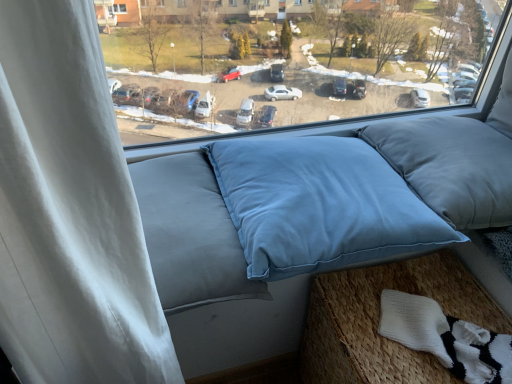
I want to click on blue fabric pillow at center, which appears as the 2th pillow when viewed from the right, so click(319, 205).

This screenshot has height=384, width=512. What do you see at coordinates (378, 321) in the screenshot?
I see `light blue fabric cushion at lower right` at bounding box center [378, 321].

What do you see at coordinates (446, 338) in the screenshot? Image resolution: width=512 pixels, height=384 pixels. I see `white knitted socks at lower right` at bounding box center [446, 338].

What do you see at coordinates (287, 72) in the screenshot?
I see `blue fabric pillows at center` at bounding box center [287, 72].

Identify the location of blue fabric pillow at center, which appears as the 2th pillow when viewed from the right. (319, 205).

Does white knitted socks at lower right have a larger size compared to satin blue pillow at center, the second pillow when ordered from left to right?

No.

Where is `material that appears on the left of satin blue pillow at center, the second pillow when ordered from left to right`? material that appears on the left of satin blue pillow at center, the second pillow when ordered from left to right is located at coordinates (446, 338).

How different are the orientations of white knitted socks at lower right and satin blue pillow at center, the second pillow when ordered from left to right, in degrees?

The facing directions of white knitted socks at lower right and satin blue pillow at center, the second pillow when ordered from left to right, are 29.2 degrees apart.

Looking at this image, is blue fabric pillows at center at the right side of white knitted socks at lower right?

In fact, blue fabric pillows at center is to the left of white knitted socks at lower right.

Consider the image. Is blue fabric pillows at center positioned far away from white knitted socks at lower right?

blue fabric pillows at center is near white knitted socks at lower right, not far away.

From a real-world perspective, which object rests below the other?

From a 3D spatial view, white knitted socks at lower right is below.

From a real-world perspective, starting from the light blue fabric cushion at lower right, which pillow is the 1st one vertically above it? Please provide its 2D coordinates.

[(319, 205)]

Is light blue fabric cushion at lower right turned away from blue fabric pillow at center, the first pillow from the left?

No.

Can you confirm if light blue fabric cushion at lower right is smaller than blue fabric pillow at center, the first pillow from the left?

No.

Looking at this image, does light blue fabric cushion at lower right have a lesser width compared to blue fabric pillow at center, the first pillow from the left?

Indeed, light blue fabric cushion at lower right has a lesser width compared to blue fabric pillow at center, the first pillow from the left.

From a real-world perspective, who is located higher, light blue fabric cushion at lower right or satin blue pillow at center, acting as the 1th pillow starting from the right?

satin blue pillow at center, acting as the 1th pillow starting from the right, is physically above.

Which object is wider, light blue fabric cushion at lower right or satin blue pillow at center, acting as the 1th pillow starting from the right?

Wider between the two is light blue fabric cushion at lower right.

Which is correct: light blue fabric cushion at lower right is inside satin blue pillow at center, the second pillow when ordered from left to right, or outside of it?

light blue fabric cushion at lower right exists outside the volume of satin blue pillow at center, the second pillow when ordered from left to right.

Between light blue fabric cushion at lower right and satin blue pillow at center, acting as the 1th pillow starting from the right, which one has larger size?

With larger size is light blue fabric cushion at lower right.

In terms of width, does blue fabric pillows at center look wider or thinner when compared to blue fabric pillow at center, which appears as the 2th pillow when viewed from the right?

blue fabric pillows at center is thinner than blue fabric pillow at center, which appears as the 2th pillow when viewed from the right.

Is point (429, 86) closer or farther from the camera than point (273, 280)?

Point (429, 86) appears to be farther away from the viewer than point (273, 280).

Is blue fabric pillows at center closer to camera compared to blue fabric pillow at center, which appears as the 2th pillow when viewed from the right?

No, blue fabric pillows at center is further to the viewer.

Where is `bed frame below the satin blue pillow at center, acting as the 1th pillow starting from the right (from a real-world perspective)`? This screenshot has width=512, height=384. bed frame below the satin blue pillow at center, acting as the 1th pillow starting from the right (from a real-world perspective) is located at coordinates (378, 321).

From the image's perspective, who appears lower, satin blue pillow at center, the second pillow when ordered from left to right, or light blue fabric cushion at lower right?

Result: light blue fabric cushion at lower right appears lower in the image.

Based on the photo, how different are the orientations of satin blue pillow at center, the second pillow when ordered from left to right, and light blue fabric cushion at lower right in degrees?

86.3 degrees.

Is satin blue pillow at center, acting as the 1th pillow starting from the right, surrounding light blue fabric cushion at lower right?

No.

Is blue fabric pillow at center, which appears as the 2th pillow when viewed from the right, closer to the viewer compared to white knitted socks at lower right?

Yes, it is in front of white knitted socks at lower right.

What's the angular difference between blue fabric pillow at center, the first pillow from the left, and white knitted socks at lower right's facing directions?

The angle between the facing direction of blue fabric pillow at center, the first pillow from the left, and the facing direction of white knitted socks at lower right is 32.4 degrees.

Is blue fabric pillow at center, the first pillow from the left, oriented towards white knitted socks at lower right?

No.

Where is `the 2nd pillow positioned above the white knitted socks at lower right (from a real-world perspective)`? Image resolution: width=512 pixels, height=384 pixels. the 2nd pillow positioned above the white knitted socks at lower right (from a real-world perspective) is located at coordinates pyautogui.click(x=451, y=167).

In the image, there is a blue fabric pillows at center. Identify the location of material below it (from a real-world perspective). This screenshot has width=512, height=384. (446, 338).

From the image, which object appears to be nearer to white knitted socks at lower right, blue fabric pillows at center or blue fabric pillow at center, the first pillow from the left?

blue fabric pillow at center, the first pillow from the left, lies closer to white knitted socks at lower right than the other object.

When comparing their distances from light blue fabric cushion at lower right, does blue fabric pillow at center, the first pillow from the left, or white knitted socks at lower right seem further?

Among the two, blue fabric pillow at center, the first pillow from the left, is located further to light blue fabric cushion at lower right.

Looking at the image, which one is located further to white knitted socks at lower right, light blue fabric cushion at lower right or blue fabric pillows at center?

The object further to white knitted socks at lower right is blue fabric pillows at center.

Based on their spatial positions, is white knitted socks at lower right or blue fabric pillow at center, which appears as the 2th pillow when viewed from the right, closer to blue fabric pillows at center?

blue fabric pillow at center, which appears as the 2th pillow when viewed from the right, lies closer to blue fabric pillows at center than the other object.

Looking at the image, which one is located closer to light blue fabric cushion at lower right, blue fabric pillow at center, which appears as the 2th pillow when viewed from the right, or satin blue pillow at center, the second pillow when ordered from left to right?

blue fabric pillow at center, which appears as the 2th pillow when viewed from the right, lies closer to light blue fabric cushion at lower right than the other object.

Considering their positions, is satin blue pillow at center, acting as the 1th pillow starting from the right, positioned closer to blue fabric pillows at center than blue fabric pillow at center, the first pillow from the left?

Based on the image, blue fabric pillow at center, the first pillow from the left, appears to be nearer to blue fabric pillows at center.

Looking at the image, which one is located closer to blue fabric pillows at center, satin blue pillow at center, the second pillow when ordered from left to right, or white knitted socks at lower right?

Among the two, satin blue pillow at center, the second pillow when ordered from left to right, is located nearer to blue fabric pillows at center.

From the image, which object appears to be farther from blue fabric pillows at center, blue fabric pillow at center, which appears as the 2th pillow when viewed from the right, or light blue fabric cushion at lower right?

Among the two, light blue fabric cushion at lower right is located further to blue fabric pillows at center.

Image resolution: width=512 pixels, height=384 pixels. What are the coordinates of `material between blue fabric pillows at center and light blue fabric cushion at lower right vertically` in the screenshot? It's located at (446, 338).

At what (x,y) coordinates should I click in order to perform the action: click on window between blue fabric pillow at center, the first pillow from the left, and satin blue pillow at center, the second pillow when ordered from left to right. Please return your answer as a coordinate pair (x, y). Looking at the image, I should click on (287, 72).

In order to click on pillow between satin blue pillow at center, acting as the 1th pillow starting from the right, and light blue fabric cushion at lower right in the up-down direction in this screenshot , I will do `click(319, 205)`.

Identify the location of material between satin blue pillow at center, acting as the 1th pillow starting from the right, and light blue fabric cushion at lower right vertically. Image resolution: width=512 pixels, height=384 pixels. (446, 338).